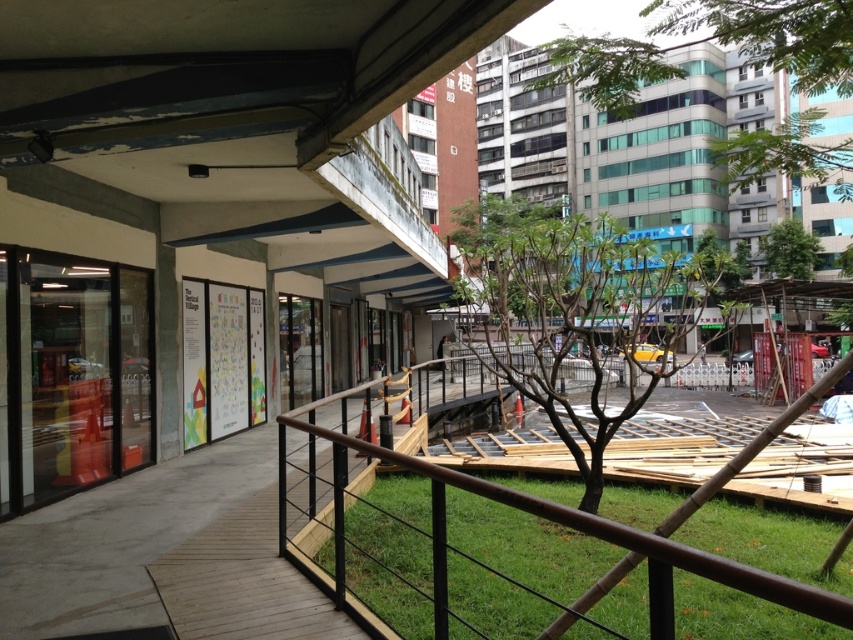
You are standing on the walkway and looking towards the covered area with glass windows and doors. Which of the two green leafy trees, the green leafy tree at upper center or the green leafy tree at upper right, appears closer to you?

The green leafy tree at upper center appears closer because it is positioned in front of the green leafy tree at upper right.

You are a city planner analyzing the urban scene. You need to determine which of the two green leafy trees, the green leafy tree at upper center or the green leafy tree at upper right, has a larger width. Based on the scene, which one is wider?

The green leafy tree at upper center has a larger width than the green leafy tree at upper right according to the description.